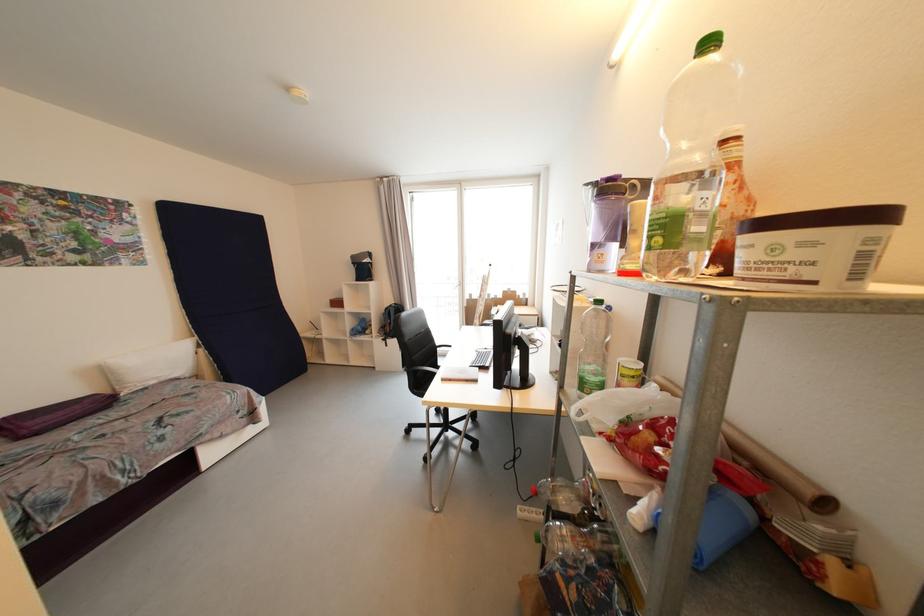
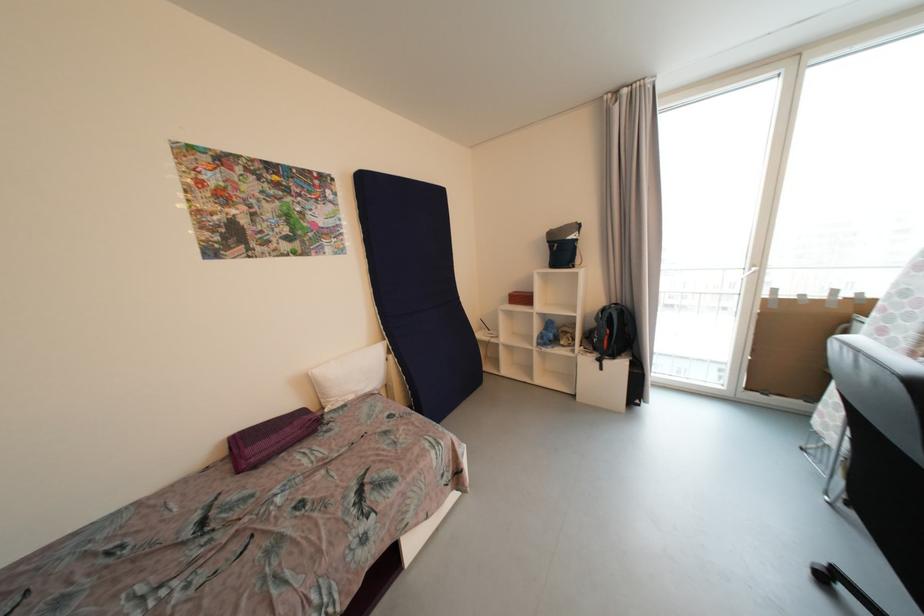
Find the pixel in the second image that matches (108,374) in the first image.

(315, 386)